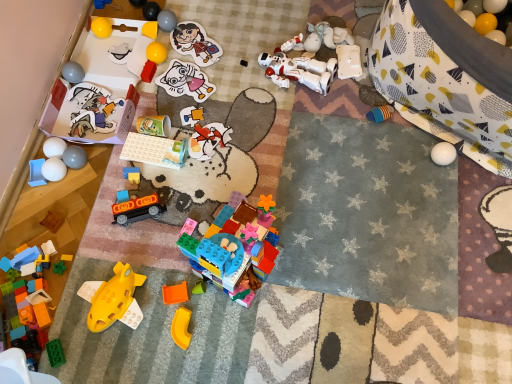
The image size is (512, 384). What are the coordinates of `vacant area that lies to the right of matte blue plastic toy at center, marked as the thirteenth toy in a right-to-left arrangement` in the screenshot? It's located at (183, 176).